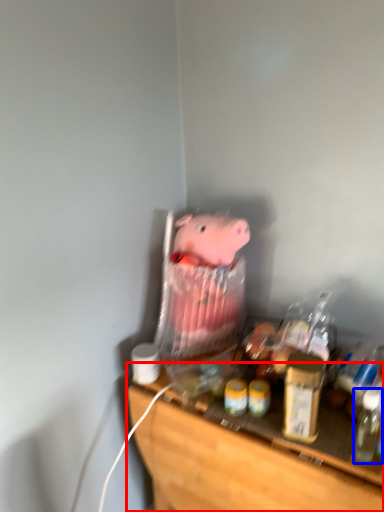
Question: Which of the following is the farthest to the observer, furniture (highlighted by a red box) or bottle (highlighted by a blue box)?

Choices:
 (A) furniture
 (B) bottle

Answer: (B)